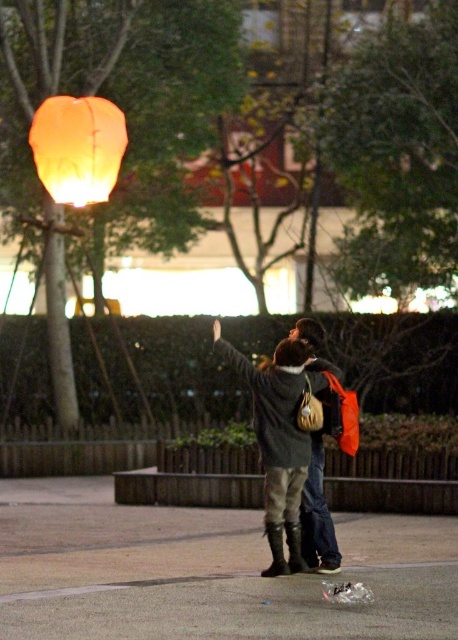
Question: Is leather jacket at center below matte orange lantern at upper left?

Choices:
 (A) yes
 (B) no

Answer: (A)

Question: Is leather jacket at center to the right of matte orange lantern at upper left from the viewer's perspective?

Choices:
 (A) no
 (B) yes

Answer: (B)

Question: Which object is farther from the camera taking this photo?

Choices:
 (A) leather jacket at center
 (B) matte orange lantern at upper left

Answer: (B)

Question: Which object is closer to the camera taking this photo?

Choices:
 (A) leather jacket at center
 (B) matte orange lantern at upper left

Answer: (A)

Question: Which point is farther to the camera?

Choices:
 (A) (295, 528)
 (B) (61, 204)

Answer: (B)

Question: Is leather jacket at center closer to camera compared to matte orange lantern at upper left?

Choices:
 (A) yes
 (B) no

Answer: (A)